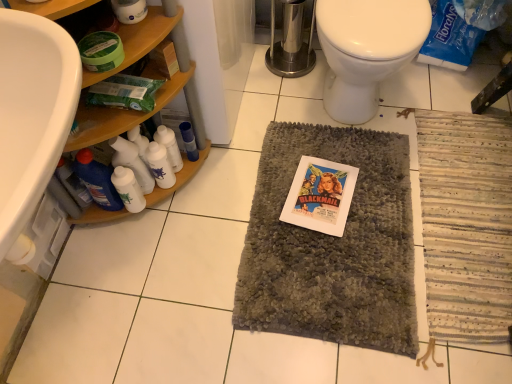
This screenshot has height=384, width=512. I want to click on free space in front of matte paper comic book at center, so click(x=333, y=261).